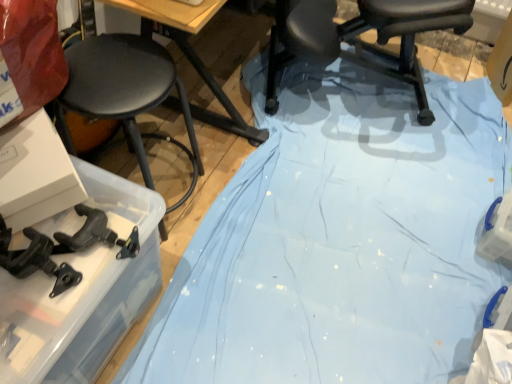
Where is `vacant region under wooden at upper center (from a real-world perspective)`? The image size is (512, 384). vacant region under wooden at upper center (from a real-world perspective) is located at coordinates (172, 132).